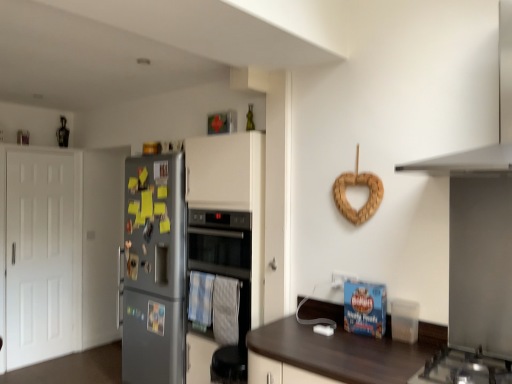
Question: From the image's perspective, relative to white matte exhaust hood at upper right, is stainless steel gas stove at lower right above or below?

Choices:
 (A) above
 (B) below

Answer: (B)

Question: Would you say stainless steel gas stove at lower right is inside or outside white matte exhaust hood at upper right?

Choices:
 (A) outside
 (B) inside

Answer: (A)

Question: Considering the real-world distances, which object is closest to the white matte exhaust hood at upper right?

Choices:
 (A) clear plastic container at lower right
 (B) white matte door at left
 (C) satin silver fridge at left
 (D) stainless steel gas stove at lower right
 (E) black glass oven at center

Answer: (A)

Question: Based on their relative distances, which object is farther from the clear plastic container at lower right?

Choices:
 (A) white matte exhaust hood at upper right
 (B) stainless steel gas stove at lower right
 (C) black glass oven at center
 (D) white matte door at left
 (E) satin silver fridge at left

Answer: (D)